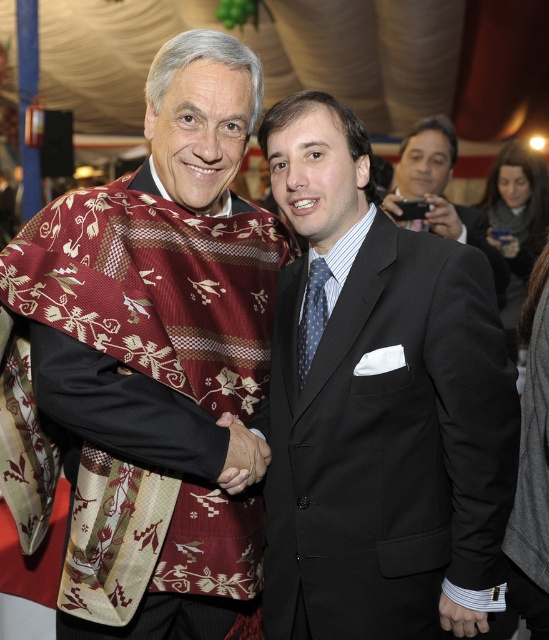
Is dark gray suit at center bigger than polka dot silk tie at center?

Yes, dark gray suit at center is bigger than polka dot silk tie at center.

Looking at this image, is dark gray suit at center closer to camera compared to polka dot silk tie at center?

No.

Is point (440, 115) farther from viewer compared to point (317, 268)?

Yes, it is.

Find the location of `dark gray suit at center`. dark gray suit at center is located at coordinates (439, 192).

Who is positioned more to the right, maroon woven shawl at center or black satin suit at center?

From the viewer's perspective, black satin suit at center appears more on the right side.

Who is shorter, maroon woven shawl at center or black satin suit at center?

With less height is black satin suit at center.

This screenshot has width=549, height=640. What do you see at coordinates (159, 358) in the screenshot?
I see `maroon woven shawl at center` at bounding box center [159, 358].

Find the location of a particular element. This screenshot has width=549, height=640. maroon woven shawl at center is located at coordinates (159, 358).

Looking at this image, can you confirm if black satin suit at center is positioned below polka dot silk tie at center?

Yes.

Is point (463, 467) more distant than point (302, 317)?

No, it is not.

What do you see at coordinates (379, 408) in the screenshot?
I see `black satin suit at center` at bounding box center [379, 408].

Where is `black satin suit at center`? The height and width of the screenshot is (640, 549). black satin suit at center is located at coordinates (379, 408).